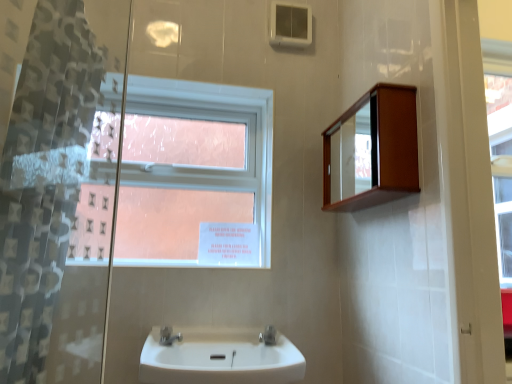
The image size is (512, 384). Describe the element at coordinates (372, 150) in the screenshot. I see `wooden cabinet at upper right` at that location.

Locate an element on the screen. The image size is (512, 384). white glossy sink at center is located at coordinates (220, 357).

The width and height of the screenshot is (512, 384). Describe the element at coordinates (268, 335) in the screenshot. I see `satin nickel faucet at sink center, acting as the 2th tap starting from the left` at that location.

The width and height of the screenshot is (512, 384). Identify the location of wooden cabinet at upper right. (372, 150).

From the image's perspective, is white glossy sink at center below satin nickel faucet at sink center, which is counted as the first tap, starting from the right?

Yes, from the image's perspective, white glossy sink at center is beneath satin nickel faucet at sink center, which is counted as the first tap, starting from the right.

From a real-world perspective, which is physically below, white glossy sink at center or satin nickel faucet at sink center, acting as the 2th tap starting from the left?

white glossy sink at center is physically lower.

From the picture: Considering the positions of objects white glossy sink at center and satin nickel faucet at sink center, which is counted as the first tap, starting from the right, in the image provided, who is more to the right, white glossy sink at center or satin nickel faucet at sink center, which is counted as the first tap, starting from the right,?

From the viewer's perspective, satin nickel faucet at sink center, which is counted as the first tap, starting from the right, appears more on the right side.

What's the angular difference between white glossy sink at center and satin nickel faucet at sink center, which is counted as the first tap, starting from the right,'s facing directions?

The angle between the facing direction of white glossy sink at center and the facing direction of satin nickel faucet at sink center, which is counted as the first tap, starting from the right, is 29.8 degrees.

Does satin nickel faucet at sink center, acting as the 2th tap starting from the left, have a smaller size compared to clear glass window at upper center?

Yes, satin nickel faucet at sink center, acting as the 2th tap starting from the left, is smaller than clear glass window at upper center.

Considering the sizes of satin nickel faucet at sink center, acting as the 2th tap starting from the left, and clear glass window at upper center in the image, is satin nickel faucet at sink center, acting as the 2th tap starting from the left, taller or shorter than clear glass window at upper center?

satin nickel faucet at sink center, acting as the 2th tap starting from the left, is shorter than clear glass window at upper center.

Does satin nickel faucet at sink center, acting as the 2th tap starting from the left, appear on the right side of clear glass window at upper center?

Yes.

Considering the sizes of clear glass window at upper center and satin nickel faucet at lower center, which is the 1th tap from left to right, in the image, is clear glass window at upper center wider or thinner than satin nickel faucet at lower center, which is the 1th tap from left to right,?

Clearly, clear glass window at upper center has less width compared to satin nickel faucet at lower center, which is the 1th tap from left to right.

From a real-world perspective, who is located lower, clear glass window at upper center or satin nickel faucet at lower center, which is the 1th tap from left to right?

satin nickel faucet at lower center, which is the 1th tap from left to right.

Can we say clear glass window at upper center lies outside satin nickel faucet at lower center, which is the 1th tap from left to right?

Absolutely, clear glass window at upper center is external to satin nickel faucet at lower center, which is the 1th tap from left to right.

Can you confirm if clear glass window at upper center is taller than satin nickel faucet at lower center, arranged as the second tap when viewed from the right?

Indeed, clear glass window at upper center has a greater height compared to satin nickel faucet at lower center, arranged as the second tap when viewed from the right.

Is point (269, 332) closer to viewer compared to point (354, 120)?

Yes.

Based on the photo, considering the sizes of objects satin nickel faucet at sink center, acting as the 2th tap starting from the left, and wooden cabinet at upper right in the image provided, who is shorter, satin nickel faucet at sink center, acting as the 2th tap starting from the left, or wooden cabinet at upper right?

satin nickel faucet at sink center, acting as the 2th tap starting from the left, is shorter.

Is wooden cabinet at upper right at the back of satin nickel faucet at sink center, which is counted as the first tap, starting from the right?

satin nickel faucet at sink center, which is counted as the first tap, starting from the right, is not turned away from wooden cabinet at upper right.

Is satin nickel faucet at lower center, arranged as the second tap when viewed from the right, turned away from translucent plastic shower curtain at left?

No, satin nickel faucet at lower center, arranged as the second tap when viewed from the right, is not facing the opposite direction of translucent plastic shower curtain at left.

Can you see satin nickel faucet at lower center, which is the 1th tap from left to right, touching translucent plastic shower curtain at left?

satin nickel faucet at lower center, which is the 1th tap from left to right, and translucent plastic shower curtain at left are not in contact.

Considering the points (170, 345) and (13, 134), which point is in front, point (170, 345) or point (13, 134)?

Point (13, 134)

From a real-world perspective, who is located higher, satin nickel faucet at lower center, arranged as the second tap when viewed from the right, or translucent plastic shower curtain at left?

translucent plastic shower curtain at left.

Relative to white glossy sink at center, is translucent plastic shower curtain at left in front or behind?

In the image, translucent plastic shower curtain at left appears in front of white glossy sink at center.

Is translucent plastic shower curtain at left looking in the opposite direction of white glossy sink at center?

translucent plastic shower curtain at left is not turned away from white glossy sink at center.

At what (x,y) coordinates should I click in order to perform the action: click on sink below the translucent plastic shower curtain at left (from a real-world perspective). Please return your answer as a coordinate pair (x, y). The width and height of the screenshot is (512, 384). Looking at the image, I should click on (220, 357).

Is point (180, 337) closer or farther from the camera than point (170, 349)?

Clearly, point (180, 337) is more distant from the camera than point (170, 349).

Is satin nickel faucet at lower center, arranged as the second tap when viewed from the right, aimed at white glossy sink at center?

Yes.

Is the surface of satin nickel faucet at lower center, arranged as the second tap when viewed from the right, in direct contact with white glossy sink at center?

satin nickel faucet at lower center, arranged as the second tap when viewed from the right, and white glossy sink at center are not in contact.

Can you tell me how much satin nickel faucet at lower center, which is the 1th tap from left to right, and white glossy sink at center differ in facing direction?

The angular difference between satin nickel faucet at lower center, which is the 1th tap from left to right, and white glossy sink at center is 41.8 degrees.

There is a white glossy sink at center. What are the coordinates of `the 1st tap above it (from the image's perspective)` in the screenshot? It's located at (268, 335).

The height and width of the screenshot is (384, 512). What are the coordinates of `window positioned vertically above the satin nickel faucet at sink center, acting as the 2th tap starting from the left (from a real-world perspective)` in the screenshot? It's located at (195, 175).

Estimate the real-world distances between objects in this image. Which object is closer to satin nickel faucet at sink center, which is counted as the first tap, starting from the right, satin nickel faucet at lower center, arranged as the second tap when viewed from the right, or clear glass window at upper center?

Answer: Among the two, satin nickel faucet at lower center, arranged as the second tap when viewed from the right, is located nearer to satin nickel faucet at sink center, which is counted as the first tap, starting from the right.

In the scene shown: When comparing their distances from translucent plastic shower curtain at left, does wooden cabinet at upper right or white glossy sink at center seem closer?

white glossy sink at center lies closer to translucent plastic shower curtain at left than the other object.

Based on their spatial positions, is satin nickel faucet at lower center, arranged as the second tap when viewed from the right, or translucent plastic shower curtain at left further from white glossy sink at center?

translucent plastic shower curtain at left lies further to white glossy sink at center than the other object.

When comparing their distances from translucent plastic shower curtain at left, does clear glass window at upper center or satin nickel faucet at lower center, arranged as the second tap when viewed from the right, seem further?

Based on the image, satin nickel faucet at lower center, arranged as the second tap when viewed from the right, appears to be further to translucent plastic shower curtain at left.

From the image, which object appears to be nearer to clear glass window at upper center, satin nickel faucet at lower center, which is the 1th tap from left to right, or white glossy sink at center?

white glossy sink at center.

Looking at the image, which one is located closer to wooden cabinet at upper right, satin nickel faucet at lower center, arranged as the second tap when viewed from the right, or clear glass window at upper center?

Based on the image, clear glass window at upper center appears to be nearer to wooden cabinet at upper right.

Considering their positions, is translucent plastic shower curtain at left positioned closer to white glossy sink at center than satin nickel faucet at lower center, arranged as the second tap when viewed from the right?

satin nickel faucet at lower center, arranged as the second tap when viewed from the right, lies closer to white glossy sink at center than the other object.

Consider the image. Looking at the image, which one is located further to satin nickel faucet at lower center, which is the 1th tap from left to right, clear glass window at upper center or translucent plastic shower curtain at left?

translucent plastic shower curtain at left is further to satin nickel faucet at lower center, which is the 1th tap from left to right.

Image resolution: width=512 pixels, height=384 pixels. Find the location of `window between wooden cabinet at upper right and white glossy sink at center in the vertical direction`. window between wooden cabinet at upper right and white glossy sink at center in the vertical direction is located at coordinates (195, 175).

At what (x,y) coordinates should I click in order to perform the action: click on sink between translucent plastic shower curtain at left and clear glass window at upper center in the front-back direction. Please return your answer as a coordinate pair (x, y). Looking at the image, I should click on (220, 357).

Find the location of `medicine cabinet between translucent plastic shower curtain at left and satin nickel faucet at sink center, acting as the 2th tap starting from the left, from front to back`. medicine cabinet between translucent plastic shower curtain at left and satin nickel faucet at sink center, acting as the 2th tap starting from the left, from front to back is located at coordinates (372, 150).

Where is `medicine cabinet positioned between translucent plastic shower curtain at left and clear glass window at upper center from near to far`? The height and width of the screenshot is (384, 512). medicine cabinet positioned between translucent plastic shower curtain at left and clear glass window at upper center from near to far is located at coordinates (372, 150).